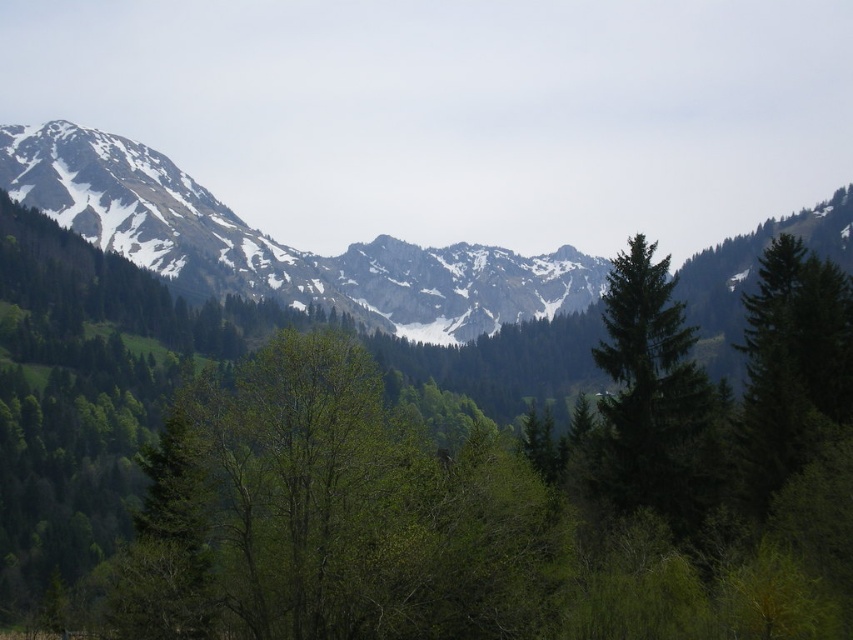
You are standing in the mountainous landscape and want to place a small flag at point A and point B. Point A is located at coordinates point (0,257) and point B is at point (677,417). According to the scene description, which point is farther from your current position?

Point A at point (0,257) is farther from your current position because it is behind point B at point (677,417).

You are a hiker standing in the valley and want to take a photo of the green leafy tree at center and the snowy rock mountain range at left. Which object will appear larger in your photo?

The green leafy tree at center will appear larger in the photo because it is closer to the viewer than the snowy rock mountain range at left.

Based on the scene description, where is the snowy rock mountain range at left located in terms of its 2D coordinates?

The snowy rock mountain range at left is located at the 2D coordinates of point (277, 244).